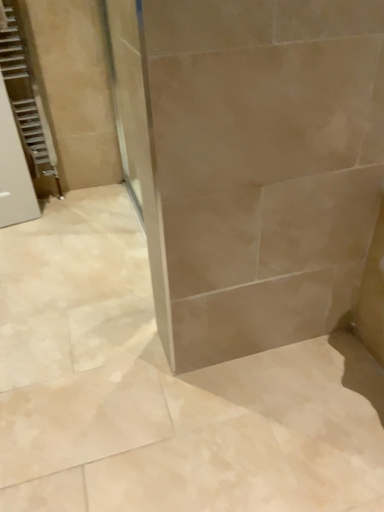
This screenshot has width=384, height=512. What do you see at coordinates (139, 144) in the screenshot? I see `clear glass screen door at center` at bounding box center [139, 144].

This screenshot has height=512, width=384. In order to click on clear glass screen door at center in this screenshot , I will do `click(139, 144)`.

The height and width of the screenshot is (512, 384). I want to click on clear glass screen door at center, so click(139, 144).